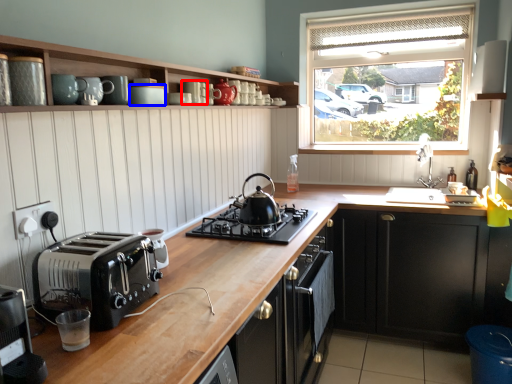
Question: Which object is closer to the camera taking this photo, appliance (highlighted by a red box) or appliance (highlighted by a blue box)?

Choices:
 (A) appliance
 (B) appliance

Answer: (B)